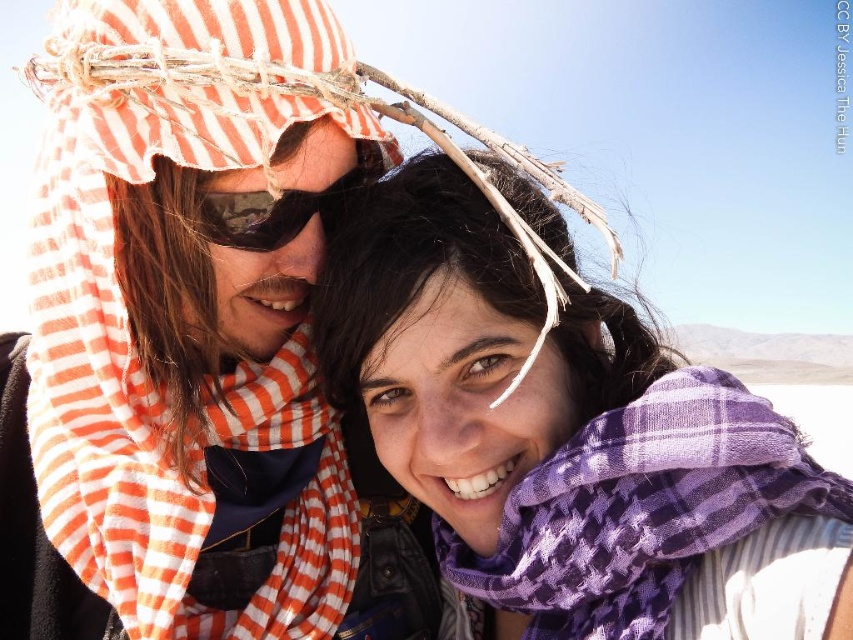
Question: Is orange striped scarf at upper left bigger than purple plaid scarf at center?

Choices:
 (A) no
 (B) yes

Answer: (A)

Question: Is orange striped scarf at upper left bigger than camouflage lens goggles at center?

Choices:
 (A) yes
 (B) no

Answer: (A)

Question: From the image, what is the correct spatial relationship of purple checkered scarf at center in relation to camouflage lens goggles at center?

Choices:
 (A) below
 (B) above

Answer: (A)

Question: Among these points, which one is farthest from the camera?

Choices:
 (A) (19, 438)
 (B) (599, 422)

Answer: (A)

Question: Which of the following is the farthest from the observer?

Choices:
 (A) (548, 424)
 (B) (701, 419)

Answer: (A)

Question: Which of the following is the farthest from the observer?

Choices:
 (A) (561, 564)
 (B) (373, 157)
 (C) (106, 122)

Answer: (B)